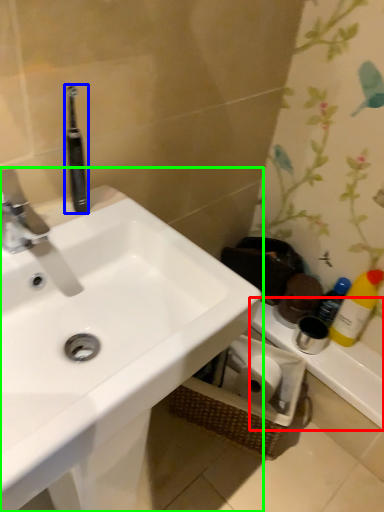
Question: Considering the real-world distances, which object is farthest from counter top (highlighted by a red box)? toothbrush (highlighted by a blue box) or sink (highlighted by a green box)?

Choices:
 (A) toothbrush
 (B) sink

Answer: (A)